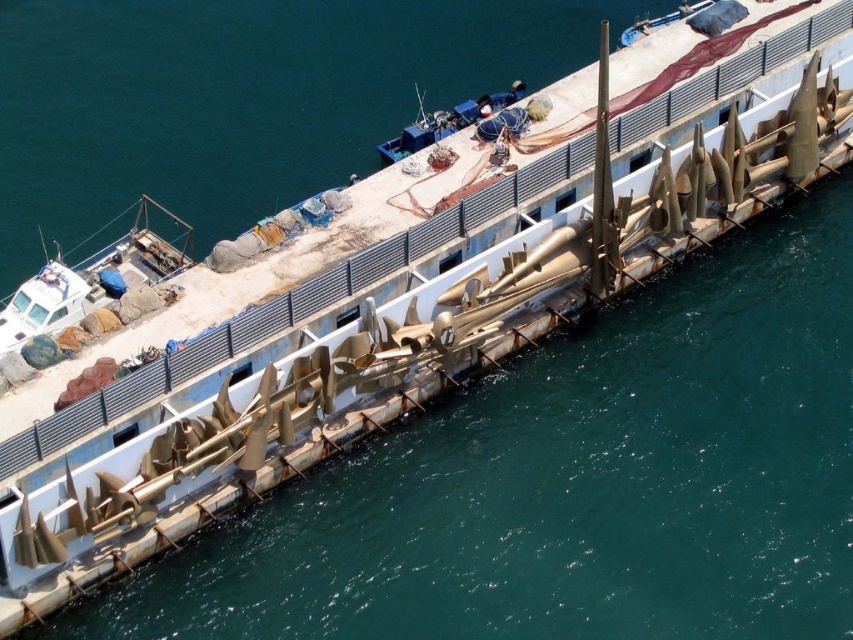
You are a dock worker who needs to transport a large container that requires a boat with a minimum length of 10 meters. You have access to the white matte boat at left and the blue plastic boat at upper center. Which boat should you choose based on their sizes?

The white matte boat at left is larger in size than the blue plastic boat at upper center, so you should choose the white matte boat at left to transport the large container since it meets the minimum length requirement.